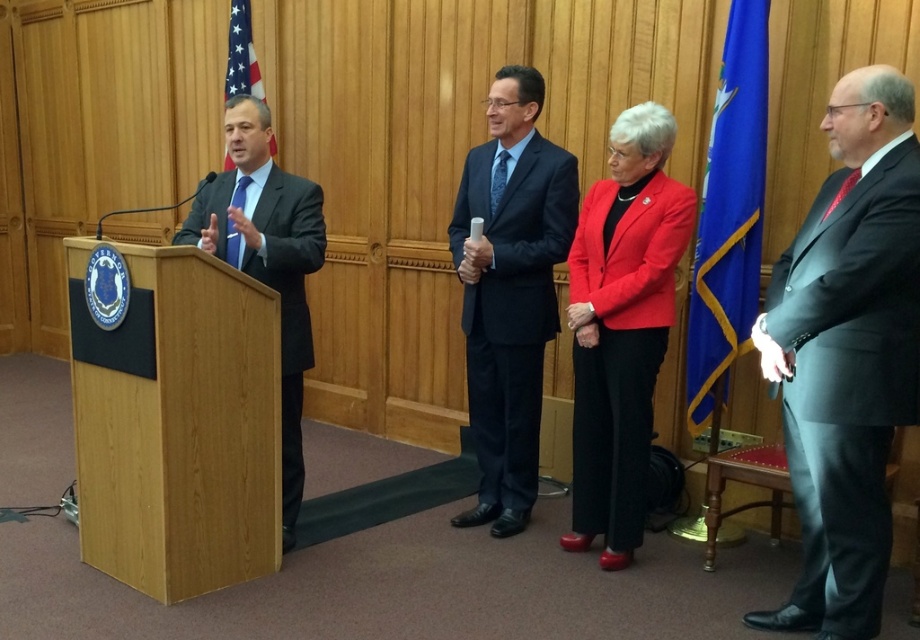
Based on the scene description, where is the blue fabric flag at right located in terms of its 2D coordinates?

The blue fabric flag at right is located at the 2D coordinates of point (729, 212).

You are a photographer trying to capture a group photo of the matte red blazer at center and the dark blue textured suit at center during the event. The camera you have can only focus on objects within a 12 inch range. Will both subjects be in focus if they are positioned exactly as shown in the image?

The matte red blazer at center and dark blue textured suit at center are 13.74 inches apart, which exceeds the camera focus range of 12 inches. Therefore, both subjects will not be in focus simultaneously.

Consider the image. You are attending an event and need to position yourself between the blue fabric flag at right and the dark blue textured suit at center. Which direction should you face to have both objects in your view?

You should face towards the center of the room so that the blue fabric flag at right is on your right side and the dark blue textured suit at center is directly in front of you.